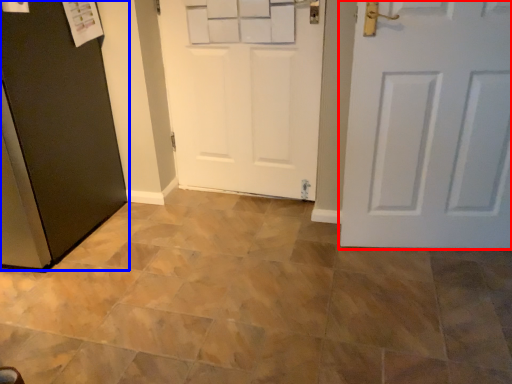
Question: Among these objects, which one is farthest to the camera, door (highlighted by a red box) or door (highlighted by a blue box)?

Choices:
 (A) door
 (B) door

Answer: (A)